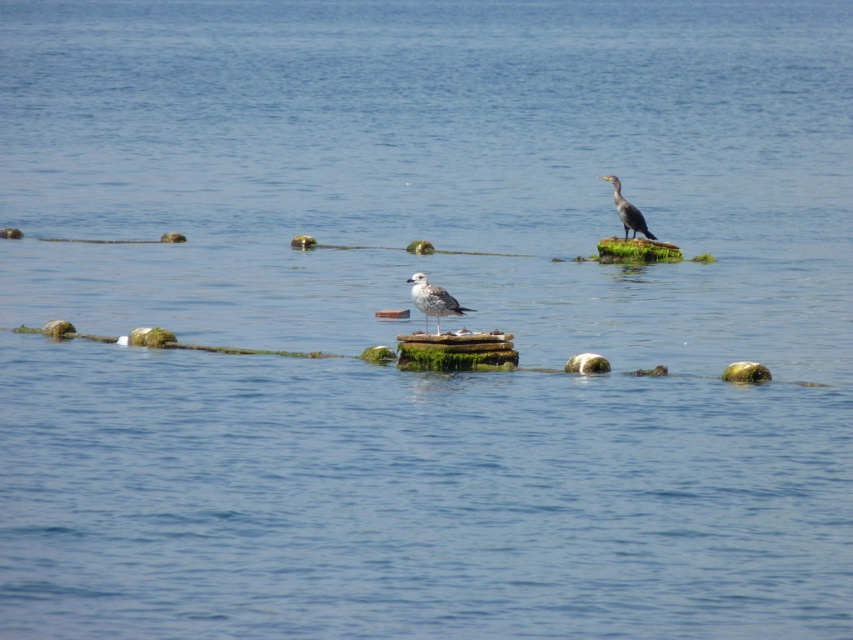
You are a photographer standing on the beach and want to capture both the white feathered bird at center and the dark gray feathers at upper right in the same frame. Your camera has a maximum zoom range of 10 meters. Can you fit both birds into your camera frame without moving closer?

The white feathered bird at center and dark gray feathers at upper right are 10.34 meters apart from each other. Since the camera can only zoom up to 10 meters, the distance between them exceeds the maximum zoom range. Therefore, you cannot fit both birds into the frame without moving closer.

You are standing on the beach and see the white feathered bird at center. If you want to throw a small pebble to reach the bird, will the distance be too far for an average person?

The white feathered bird at center is 21.62 meters away from the viewer. An average person can throw a pebble about 20 meters, so it might be too far to reach.

You are a birdwatcher observing two birds in a coastal area. You see a white feathered bird at center and a dark gray feathers at upper right. Which bird is larger in size?

The dark gray feathers at upper right is larger than the white feathered bird at center.